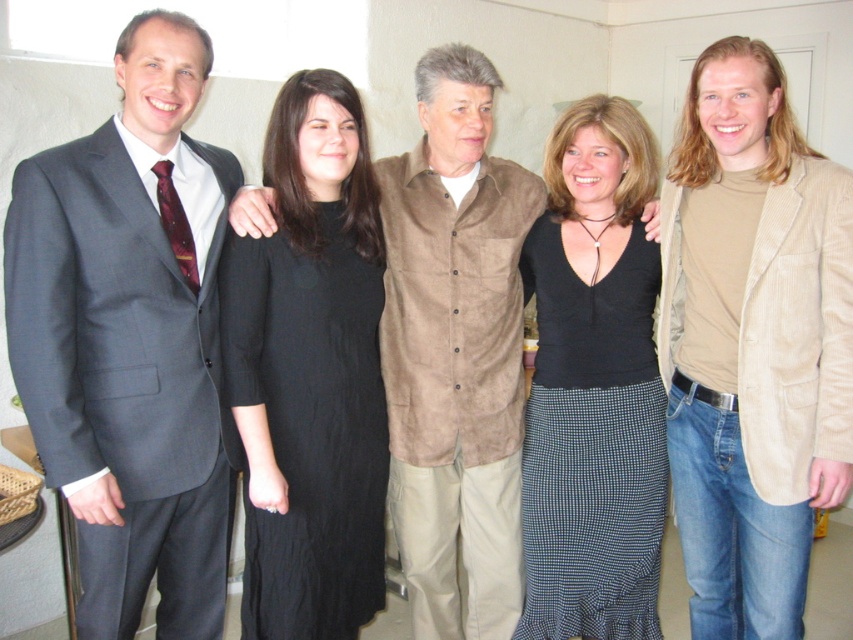
You are organizing a group photo shoot and need to arrange the matte gray suit at left and the black dress at center in a row. If the total space available is exactly equal to the combined width of both items, which side should the wider object be placed on to ensure they fit without overlapping?

The matte gray suit at left is wider than the black dress at center. To fit them without overlapping in the available space, the wider matte gray suit at left should be placed on one side, and the narrower black dress at center on the opposite side.

You are a photographer setting up for a group photo. You notice two black items at the center of the image. What is the relationship between the black cotton dress at center and the black jersey at center in terms of their positioning?

The black cotton dress at center is positioned over the black jersey at center, meaning the dress is in front of the jersey in the image.

You are standing in front of the group photo. If you want to find the black dress at center, where should you look relative to the other people in the image?

The black dress at center is located at point [752,342], which places it centrally within the image frame. Since the coordinates are normalized, the black dress at center is positioned at the center of the image, making it easy to spot among the group.